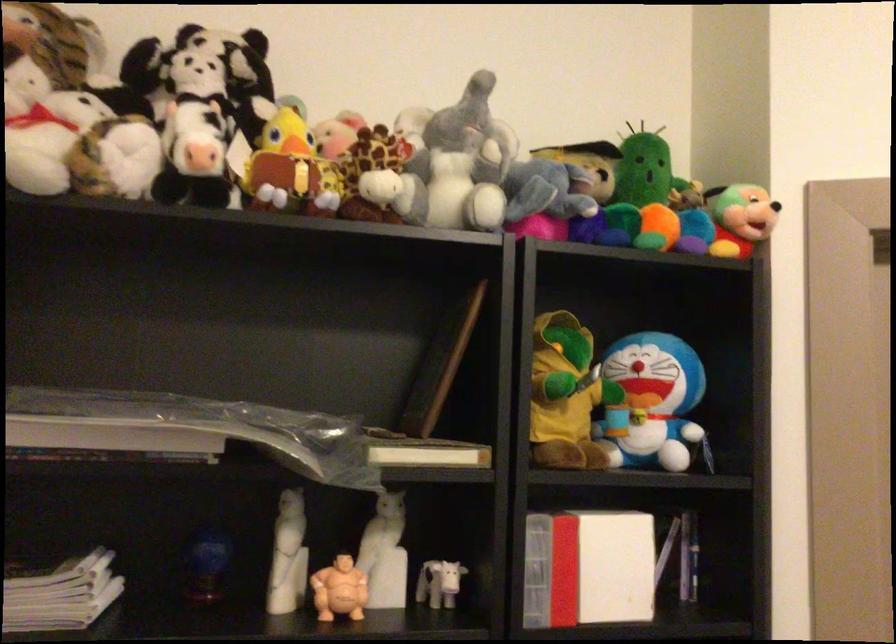
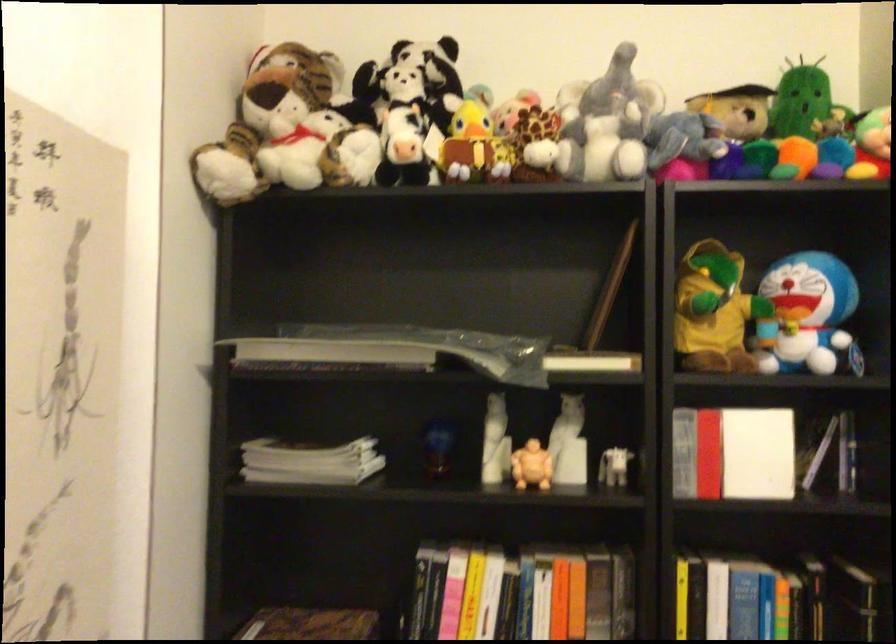
In the second image, find the point that corresponds to pixel 428 453 in the first image.

(591, 361)